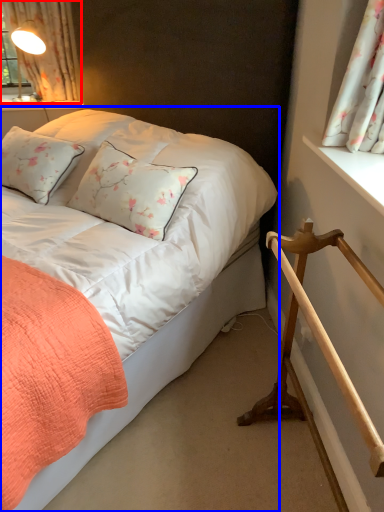
Question: Which object appears closest to the camera in this image, curtain (highlighted by a red box) or bed (highlighted by a blue box)?

Choices:
 (A) curtain
 (B) bed

Answer: (B)